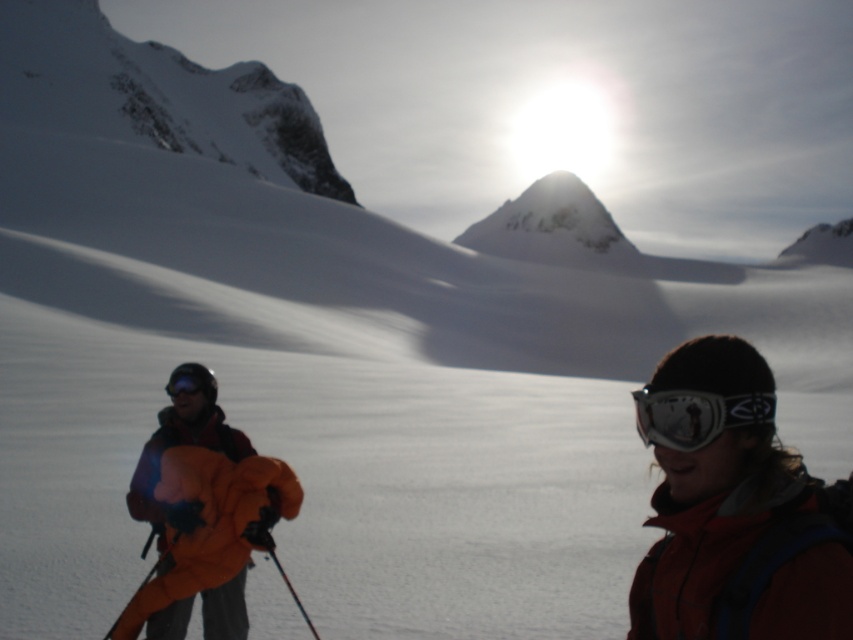
Question: Does matte orange jacket at lower right appear over matte black goggles at left?

Choices:
 (A) yes
 (B) no

Answer: (A)

Question: Is matte orange jacket at lower right thinner than white matte goggles at lower right?

Choices:
 (A) no
 (B) yes

Answer: (B)

Question: Can you confirm if matte orange jacket at lower right is positioned above white matte goggles at lower right?

Choices:
 (A) no
 (B) yes

Answer: (B)

Question: Estimate the real-world distances between objects in this image. Which object is farther from the matte black goggles at left?

Choices:
 (A) matte orange jacket at lower right
 (B) white matte goggles at lower right

Answer: (A)

Question: Which of the following is the farthest from the observer?

Choices:
 (A) white matte goggles at lower right
 (B) matte orange jacket at lower right
 (C) matte black goggles at left

Answer: (C)

Question: Estimate the real-world distances between objects in this image. Which object is farther from the white matte goggles at lower right?

Choices:
 (A) matte black goggles at left
 (B) matte orange jacket at lower right

Answer: (A)